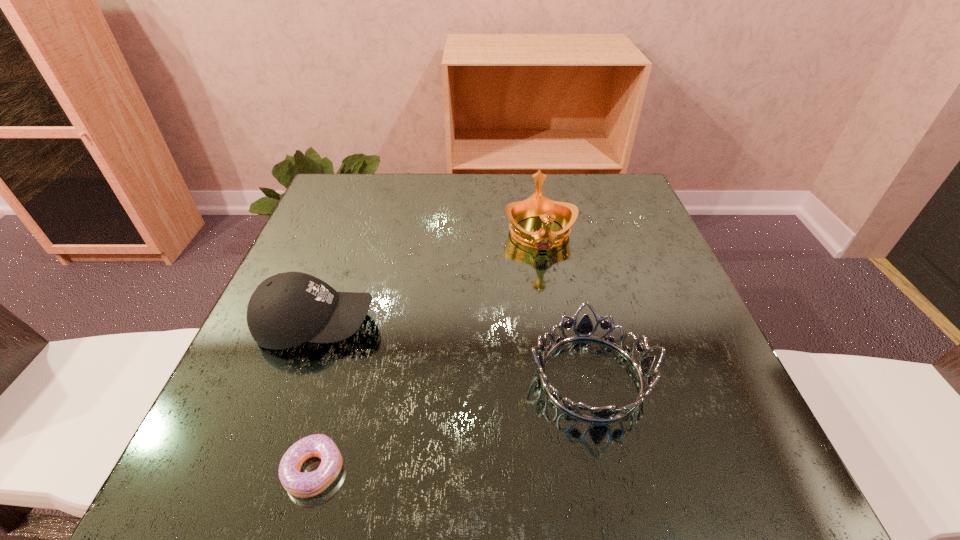
You are a GUI agent. You are given a task and a screenshot of the screen. Output one action in this format:
    pyautogui.click(x=<x>, y=<y>)
    Task: Click on the farther tiara
    The width and height of the screenshot is (960, 540).
    Given the screenshot: What is the action you would take?
    pyautogui.click(x=565, y=214)

Image resolution: width=960 pixels, height=540 pixels. Find the location of `the taller tiara`. the taller tiara is located at coordinates (565, 214).

This screenshot has height=540, width=960. In order to click on baseball cap in this screenshot , I will do `click(287, 309)`.

Locate an element on the screen. Image resolution: width=960 pixels, height=540 pixels. the third tallest object is located at coordinates (584, 329).

This screenshot has width=960, height=540. I want to click on the shorter tiara, so click(x=584, y=329).

The width and height of the screenshot is (960, 540). I want to click on doughnut, so click(303, 485).

Locate an element on the screen. the nearest object is located at coordinates (303, 485).

Locate an element on the screen. vacant area situated at the front emblem of the farther tiara is located at coordinates (568, 404).

This screenshot has height=540, width=960. I want to click on vacant area situated 0.380m on the front-facing side of the baseball cap, so click(x=579, y=325).

Where is `free space located 0.060m on the front-facing side of the shorter tiara`? This screenshot has width=960, height=540. free space located 0.060m on the front-facing side of the shorter tiara is located at coordinates (492, 376).